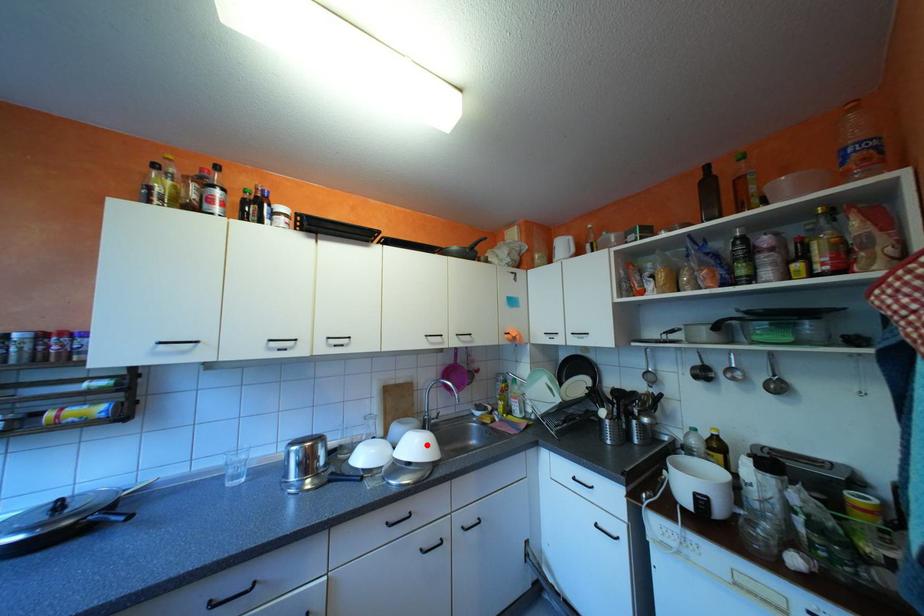
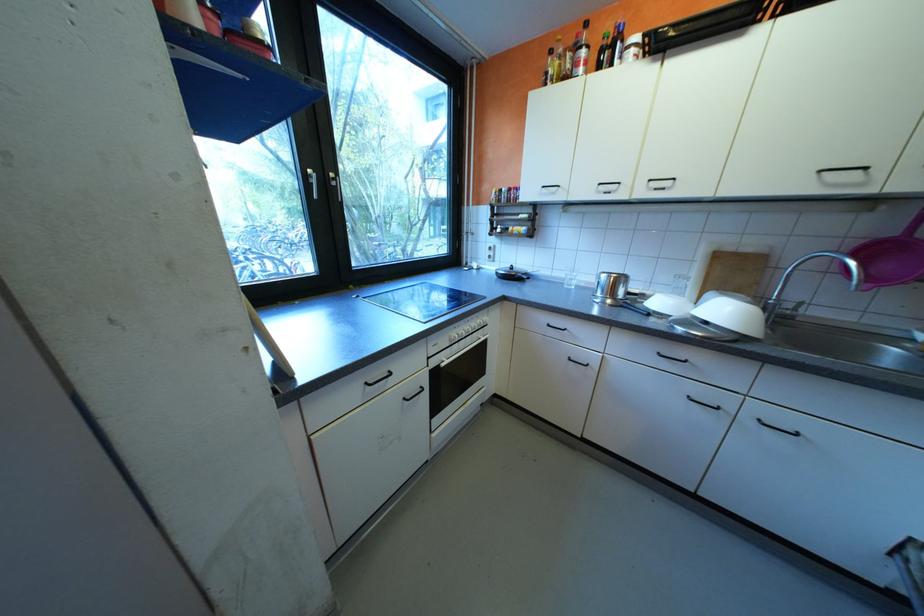
Locate, in the second image, the point that corresponds to the highlighted location in the first image.

(736, 312)